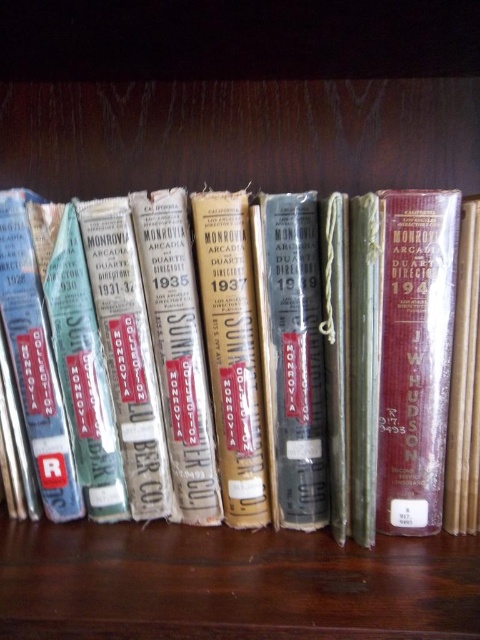
Who is positioned more to the right, wooden shelf at center or hardcover book at center?

hardcover book at center

Does wooden shelf at center have a greater height compared to hardcover book at center?

Incorrect, wooden shelf at center's height is not larger of hardcover book at center's.

The width and height of the screenshot is (480, 640). In order to click on wooden shelf at center in this screenshot , I will do `click(230, 582)`.

The image size is (480, 640). What are the coordinates of `wooden shelf at center` in the screenshot? It's located at (230, 582).